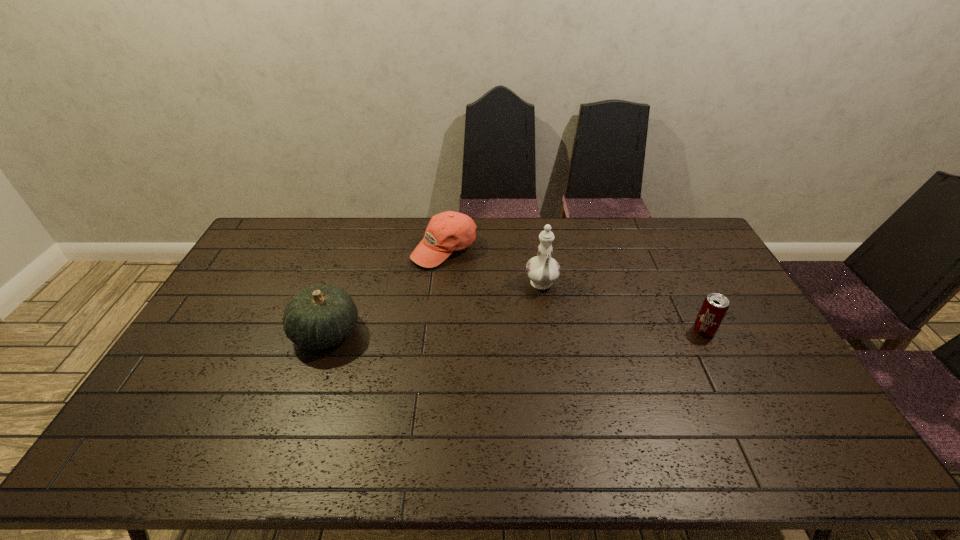
Find the location of a particular element. This screenshot has width=960, height=540. free space on the desktop that is between the third shortest object and the beer can and is positioned at the spout of the tallest object is located at coordinates (548, 332).

I want to click on vacant space on the desktop that is between the gourd and the beer can and is positioned on the front-facing side of the second object from left to right, so click(465, 332).